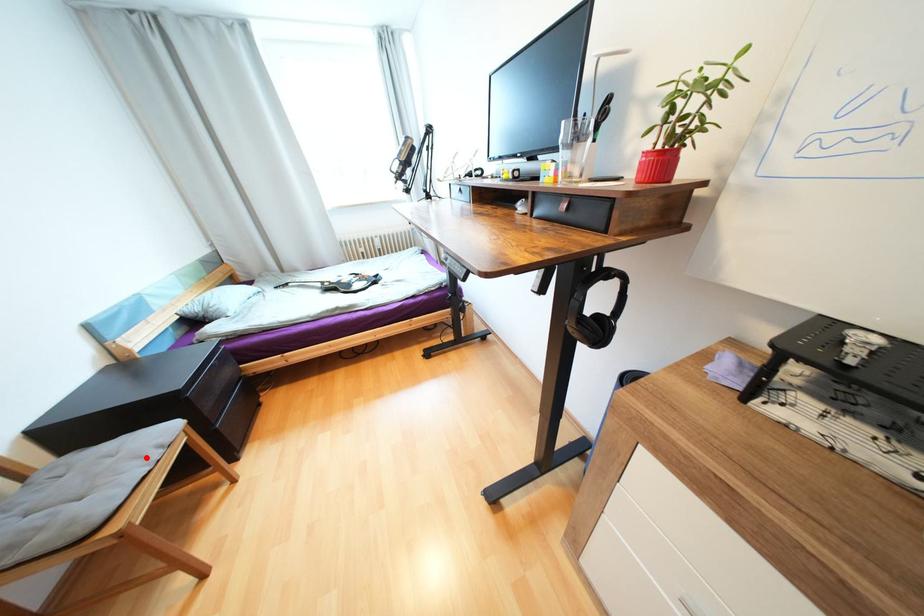
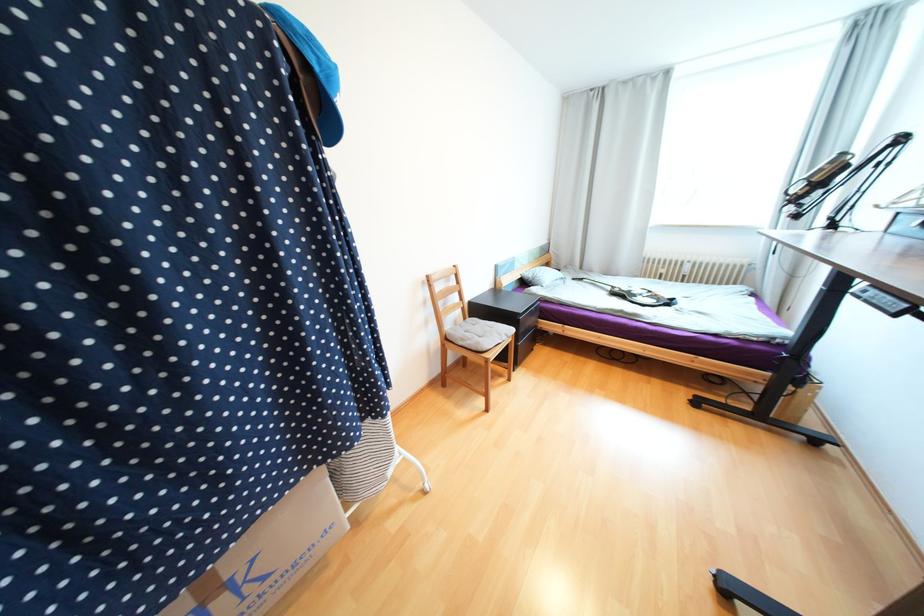
In the second image, find the point that corresponds to the highlighted location in the first image.

(505, 334)